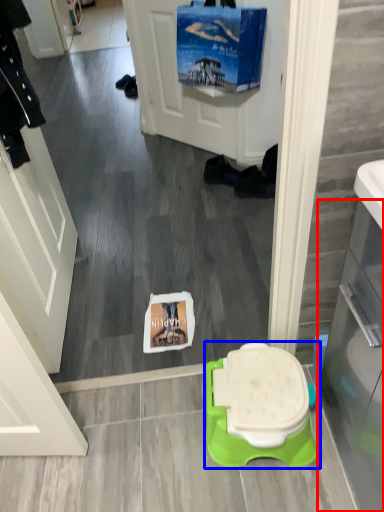
Question: Among these objects, which one is farthest to the camera, glass door (highlighted by a red box) or toilet (highlighted by a blue box)?

Choices:
 (A) glass door
 (B) toilet

Answer: (B)